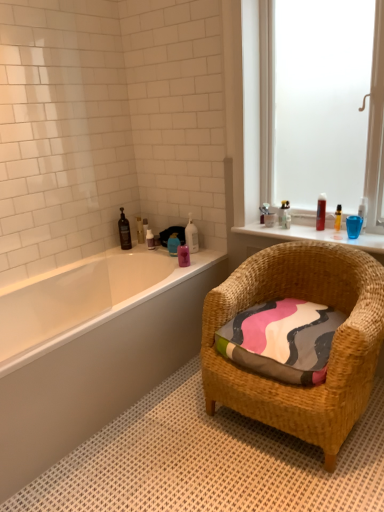
Question: Considering the positions of clear plastic bottle at upper right, which is the ninth toiletry in left-to-right order, and clear plastic bottle at upper right, which is the eighth toiletry in left-to-right order, in the image, is clear plastic bottle at upper right, which is the ninth toiletry in left-to-right order, bigger or smaller than clear plastic bottle at upper right, which is the eighth toiletry in left-to-right order,?

Choices:
 (A) small
 (B) big

Answer: (A)

Question: From the image's perspective, is clear plastic bottle at upper right, which is the ninth toiletry in left-to-right order, positioned above or below clear plastic bottle at upper right, the 3th toiletry from the right?

Choices:
 (A) below
 (B) above

Answer: (B)

Question: Which is nearer to the translucent glass bottles at upper right?

Choices:
 (A) pink glossy bottle at upper center, which is the fifth toiletry in right-to-left order
 (B) transparent glass window at upper right
 (C) translucent plastic bottle at upper right, which is the tenth toiletry in left-to-right order
 (D) white glossy bottle at upper center, which is the 4th toiletry from right to left
 (E) translucent plastic soap dispenser at upper center, acting as the seventh toiletry starting from the right

Answer: (C)

Question: Which is nearer to the white glossy bathtub at lower left?

Choices:
 (A) translucent plastic bottle at upper center, the 6th toiletry in the right-to-left sequence
 (B) pink glossy bottle at upper center, which is the fifth toiletry in right-to-left order
 (C) translucent plastic bottle at upper left, the eighth toiletry in the right-to-left sequence
 (D) translucent plastic bottle at upper right, placed as the first toiletry when sorted from right to left
 (E) textured woven pillow at lower right

Answer: (B)